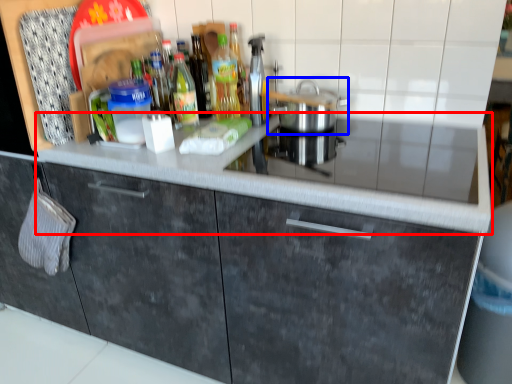
Question: Which object is closer to the camera taking this photo, countertop (highlighted by a red box) or home appliance (highlighted by a blue box)?

Choices:
 (A) countertop
 (B) home appliance

Answer: (A)